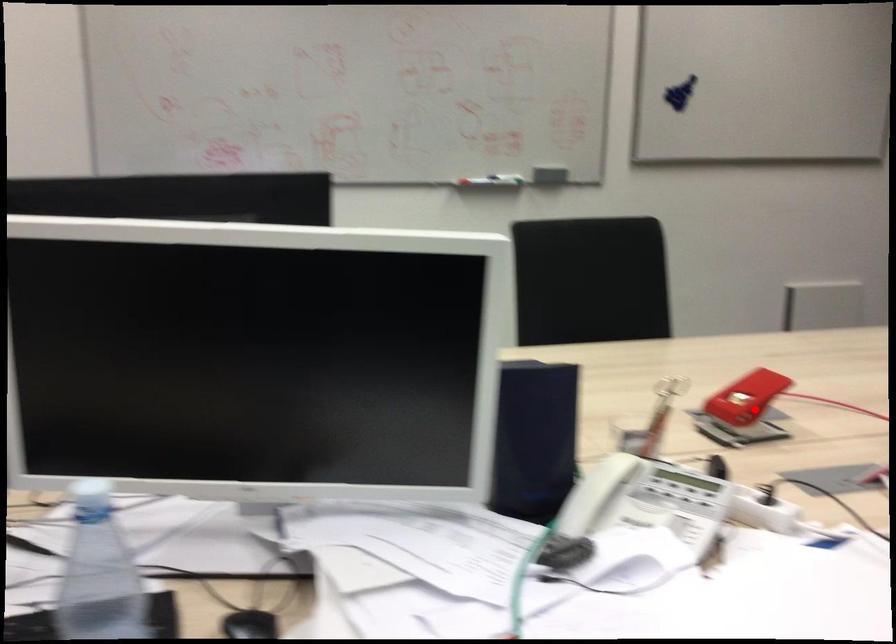
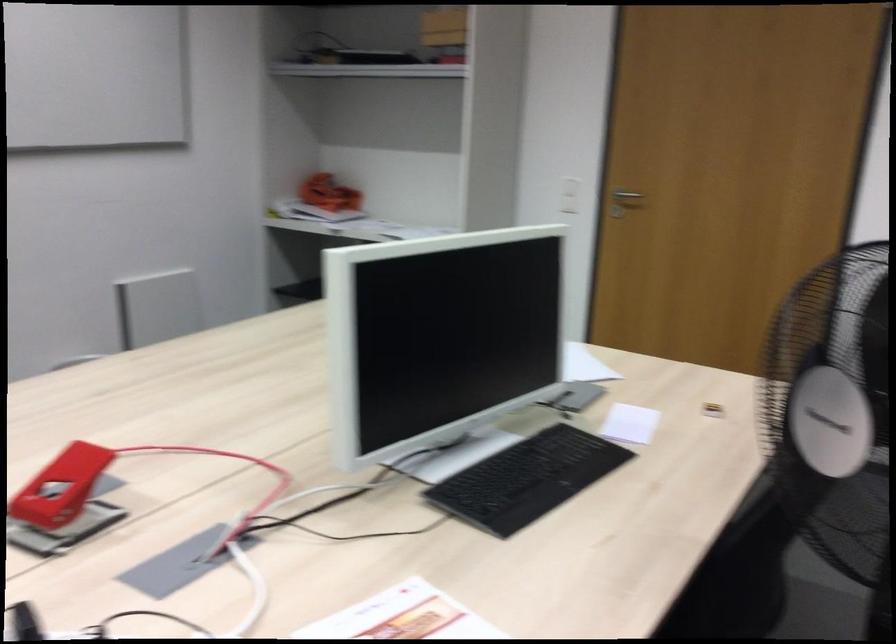
Where in the second image is the point corresponding to the highlighted location from the first image?

(101, 494)